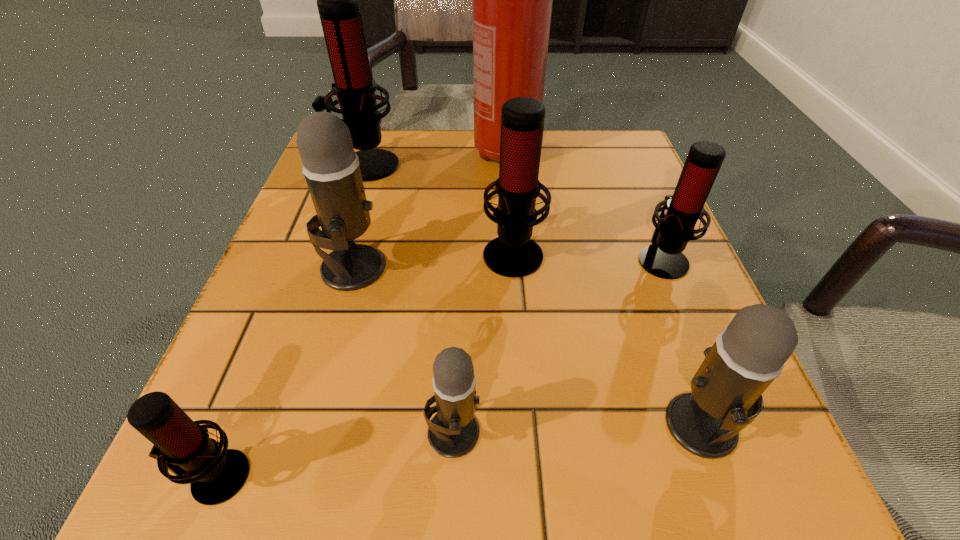
At what (x,y) coordinates should I click in order to perform the action: click on vacant space that satisfies the following two spatial constraints: 1. on the front side of the second red microphone from right to left; 2. on the left side of the farthest microphone. Please return your answer as a coordinate pair (x, y). Looking at the image, I should click on (335, 252).